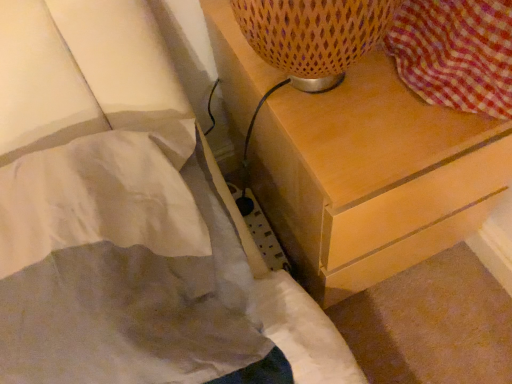
Where is `white fabric bed at lower left`? white fabric bed at lower left is located at coordinates (128, 220).

The image size is (512, 384). What do you see at coordinates (128, 220) in the screenshot? I see `white fabric bed at lower left` at bounding box center [128, 220].

Locate an element on the screen. The image size is (512, 384). light brown wood chest of drawers at upper right is located at coordinates (373, 177).

This screenshot has height=384, width=512. What do you see at coordinates (373, 177) in the screenshot? I see `light brown wood chest of drawers at upper right` at bounding box center [373, 177].

This screenshot has width=512, height=384. Identify the location of white fabric bed at lower left. (128, 220).

Considering the positions of objects light brown wood chest of drawers at upper right and white fabric bed at lower left in the image provided, who is more to the left, light brown wood chest of drawers at upper right or white fabric bed at lower left?

Positioned to the left is white fabric bed at lower left.

Is light brown wood chest of drawers at upper right closer to camera compared to white fabric bed at lower left?

No, light brown wood chest of drawers at upper right is behind white fabric bed at lower left.

Is point (282, 228) closer to camera compared to point (169, 130)?

No, (282, 228) is behind (169, 130).

From the image's perspective, is light brown wood chest of drawers at upper right located above or below white fabric bed at lower left?

From the image's perspective, light brown wood chest of drawers at upper right appears above white fabric bed at lower left.

From a real-world perspective, who is located lower, light brown wood chest of drawers at upper right or white fabric bed at lower left?

light brown wood chest of drawers at upper right.

Considering the sizes of objects light brown wood chest of drawers at upper right and white fabric bed at lower left in the image provided, who is wider, light brown wood chest of drawers at upper right or white fabric bed at lower left?

light brown wood chest of drawers at upper right.

Between light brown wood chest of drawers at upper right and white fabric bed at lower left, which one has less height?

With less height is white fabric bed at lower left.

Based on the photo, based on their sizes in the image, would you say light brown wood chest of drawers at upper right is bigger or smaller than white fabric bed at lower left?

light brown wood chest of drawers at upper right is bigger than white fabric bed at lower left.

Consider the image. Would you say light brown wood chest of drawers at upper right is inside or outside white fabric bed at lower left?

light brown wood chest of drawers at upper right is spatially situated outside white fabric bed at lower left.

Is light brown wood chest of drawers at upper right far from white fabric bed at lower left?

Actually, light brown wood chest of drawers at upper right and white fabric bed at lower left are a little close together.

Is light brown wood chest of drawers at upper right positioned with its back to white fabric bed at lower left?

No.

This screenshot has height=384, width=512. There is a light brown wood chest of drawers at upper right. In order to click on bed above it (from a real-world perspective) in this screenshot , I will do `click(128, 220)`.

Which is more to the right, white fabric bed at lower left or light brown wood chest of drawers at upper right?

light brown wood chest of drawers at upper right.

Is white fabric bed at lower left in front of light brown wood chest of drawers at upper right?

Yes, white fabric bed at lower left is closer to the viewer.

Between point (114, 363) and point (458, 192), which one is positioned in front?

The point (114, 363) is closer.

From the image's perspective, who appears lower, white fabric bed at lower left or light brown wood chest of drawers at upper right?

white fabric bed at lower left, from the image's perspective.

From a real-world perspective, which object rests below the other?

light brown wood chest of drawers at upper right, from a real-world perspective.

Considering the sizes of objects white fabric bed at lower left and light brown wood chest of drawers at upper right in the image provided, who is wider, white fabric bed at lower left or light brown wood chest of drawers at upper right?

light brown wood chest of drawers at upper right.

From the picture: Considering the sizes of objects white fabric bed at lower left and light brown wood chest of drawers at upper right in the image provided, who is taller, white fabric bed at lower left or light brown wood chest of drawers at upper right?

light brown wood chest of drawers at upper right.

Considering the sizes of objects white fabric bed at lower left and light brown wood chest of drawers at upper right in the image provided, who is smaller, white fabric bed at lower left or light brown wood chest of drawers at upper right?

With smaller size is white fabric bed at lower left.

Which is correct: white fabric bed at lower left is inside light brown wood chest of drawers at upper right, or outside of it?

white fabric bed at lower left cannot be found inside light brown wood chest of drawers at upper right.

Is white fabric bed at lower left next to light brown wood chest of drawers at upper right and touching it?

No.

Is white fabric bed at lower left oriented towards light brown wood chest of drawers at upper right?

No, white fabric bed at lower left is not turned towards light brown wood chest of drawers at upper right.

How different are the orientations of white fabric bed at lower left and light brown wood chest of drawers at upper right in degrees?

They differ by 2.27 degrees in their facing directions.

Measure the distance between white fabric bed at lower left and light brown wood chest of drawers at upper right.

The distance of white fabric bed at lower left from light brown wood chest of drawers at upper right is 8.46 inches.

Where is `bed in front of the light brown wood chest of drawers at upper right`? The width and height of the screenshot is (512, 384). bed in front of the light brown wood chest of drawers at upper right is located at coordinates (128, 220).

In the image, there is a light brown wood chest of drawers at upper right. In order to click on bed below it (from the image's perspective) in this screenshot , I will do `click(128, 220)`.

The height and width of the screenshot is (384, 512). I want to click on chest of drawers on the right of white fabric bed at lower left, so click(373, 177).